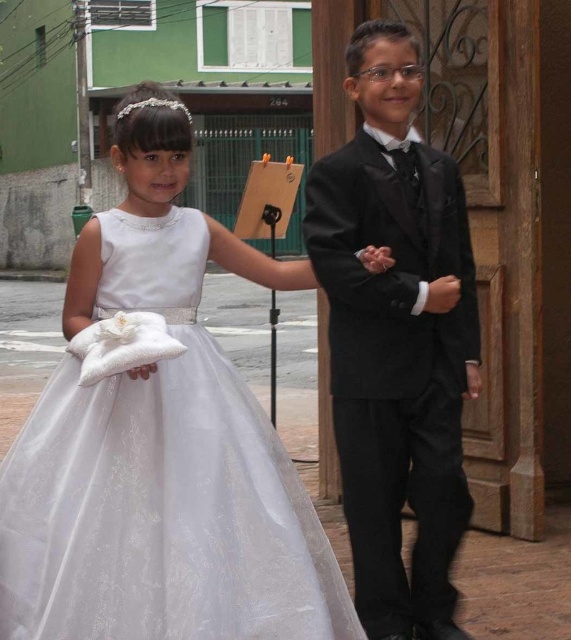
Which of these two, white satin dress at center or black satin suit at center, stands taller?

With more height is black satin suit at center.

Can you confirm if white satin dress at center is taller than black satin suit at center?

No.

Does point (151, 538) come closer to viewer compared to point (468, 499)?

Yes, it is in front of point (468, 499).

At what (x,y) coordinates should I click in order to perform the action: click on white satin dress at center. Please return your answer as a coordinate pair (x, y). Image resolution: width=571 pixels, height=640 pixels. Looking at the image, I should click on (160, 483).